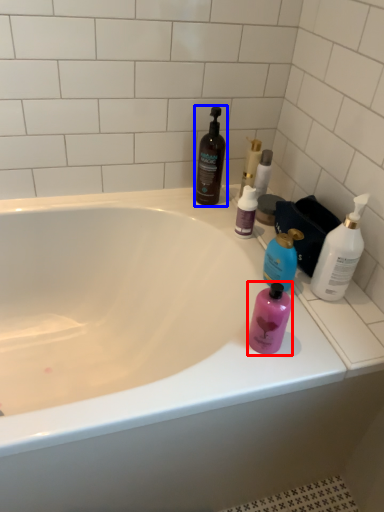
Question: Which object appears farthest to the camera in this image, bottle (highlighted by a red box) or bottle (highlighted by a blue box)?

Choices:
 (A) bottle
 (B) bottle

Answer: (B)